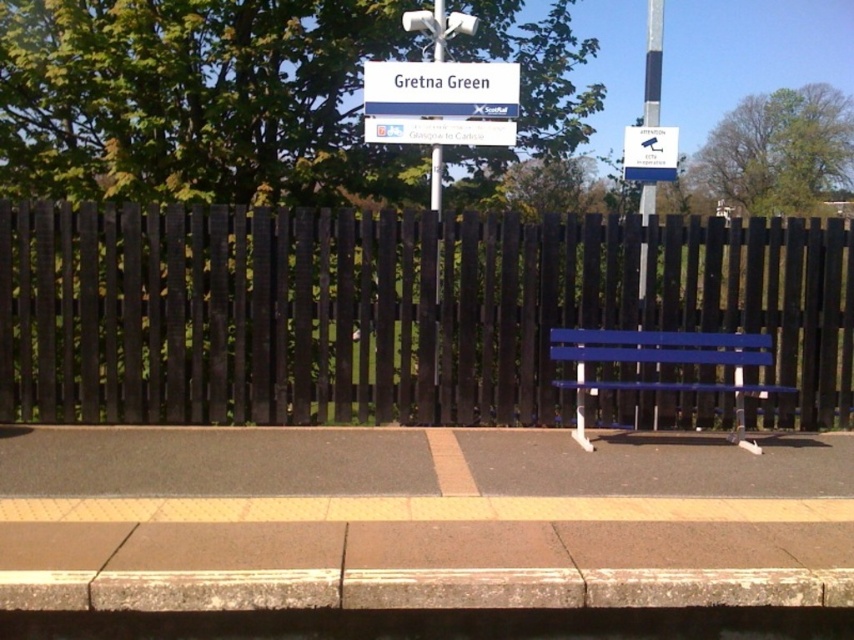
Question: From the image, what is the correct spatial relationship of blue painted wood bench at center in relation to blue plastic sign at center?

Choices:
 (A) left
 (B) right

Answer: (B)

Question: Does blue plastic sign at center lie behind blue painted metal pole at center?

Choices:
 (A) yes
 (B) no

Answer: (A)

Question: Which point is farther to the camera?

Choices:
 (A) metallic blue sign at center
 (B) blue painted metal pole at center

Answer: (A)

Question: Which point is closer to the camera taking this photo?

Choices:
 (A) (525, 365)
 (B) (581, 372)

Answer: (B)

Question: Is dark brown wooden fence at center above metallic blue sign at center?

Choices:
 (A) no
 (B) yes

Answer: (A)

Question: Which is farther from the blue painted metal pole at center?

Choices:
 (A) blue plastic sign at center
 (B) metallic blue sign at center
 (C) dark brown wooden fence at center

Answer: (B)